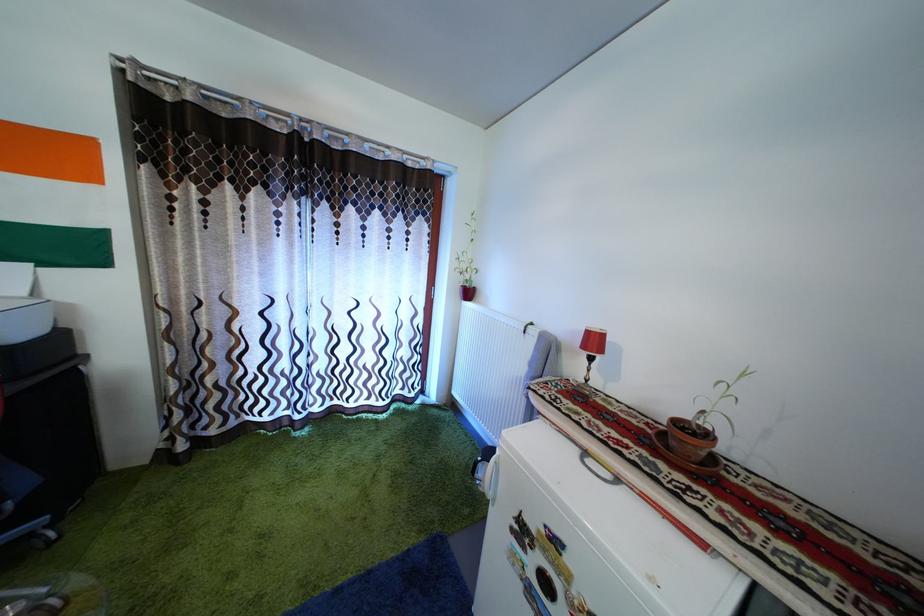
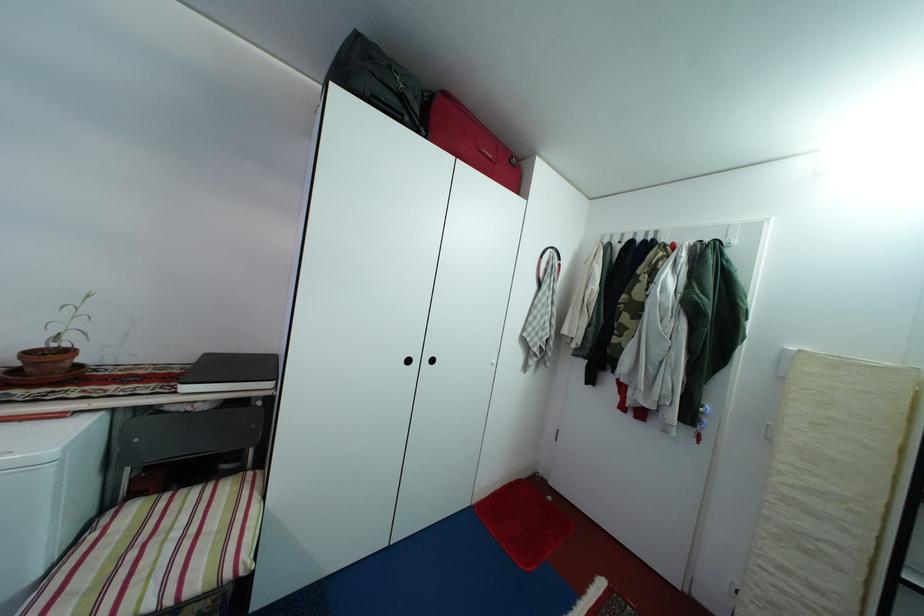
Question: The images are taken continuously from a first-person perspective. In which direction is your viewpoint rotating?

Choices:
 (A) Left
 (B) Right
 (C) Up
 (D) Down

Answer: (B)